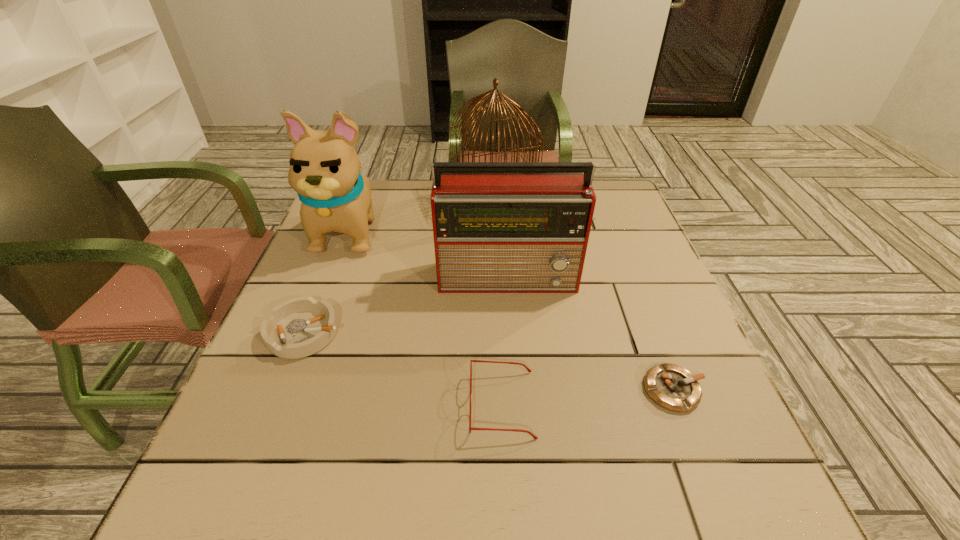
Identify the location of object situated at the right edge. The image size is (960, 540). coord(672,387).

Locate an element on the screen. The image size is (960, 540). object positioned at the far left corner is located at coordinates (324, 169).

Identify the location of free space at the far edge of the desktop. The height and width of the screenshot is (540, 960). (427, 198).

At what (x,y) coordinates should I click in order to perform the action: click on vacant space at the near edge of the desktop. Please return your answer as a coordinate pair (x, y). Looking at the image, I should click on (359, 512).

Locate an element on the screen. The height and width of the screenshot is (540, 960). vacant area at the left edge is located at coordinates (240, 449).

Locate an element on the screen. free space at the right edge of the desktop is located at coordinates (612, 253).

This screenshot has width=960, height=540. Find the location of `vacant area that lies between the shortest object and the puppy`. vacant area that lies between the shortest object and the puppy is located at coordinates (512, 310).

Image resolution: width=960 pixels, height=540 pixels. In order to click on blank region between the farther ashtray and the puppy in this screenshot , I will do `click(327, 282)`.

This screenshot has height=540, width=960. I want to click on free space between the rightmost object and the third tallest object, so click(x=592, y=334).

This screenshot has height=540, width=960. What are the coordinates of `free spot between the birdcage and the farther ashtray` in the screenshot? It's located at (399, 266).